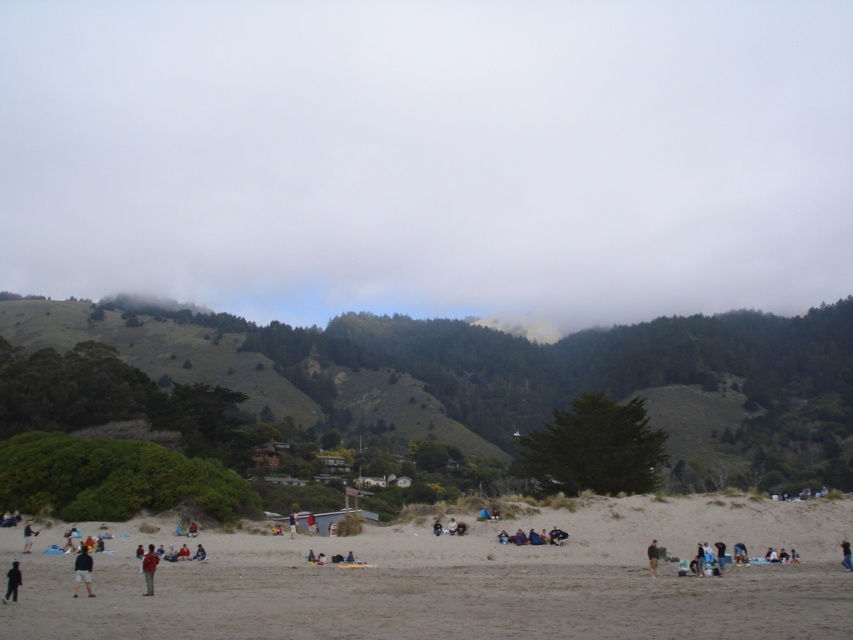
You are standing on the beach and see the red fabric jacket at lower left and the dark brown leather jacket at lower right. Which jacket is positioned higher up in the image?

The red fabric jacket at lower left is located above the dark brown leather jacket at lower right in the image.

You are a beachgoer who wants to borrow a jacket from either the red fabric jacket at lower left or the dark brown leather jacket at lower right. Which jacket would you choose if you prefer a larger size?

The red fabric jacket at lower left is bigger than the dark brown leather jacket at lower right, so you should choose the red fabric jacket at lower left for a larger size.

What are the coordinates of the white fluffy cloud at upper center?

The white fluffy cloud at upper center is located at coordinates point (428,156).